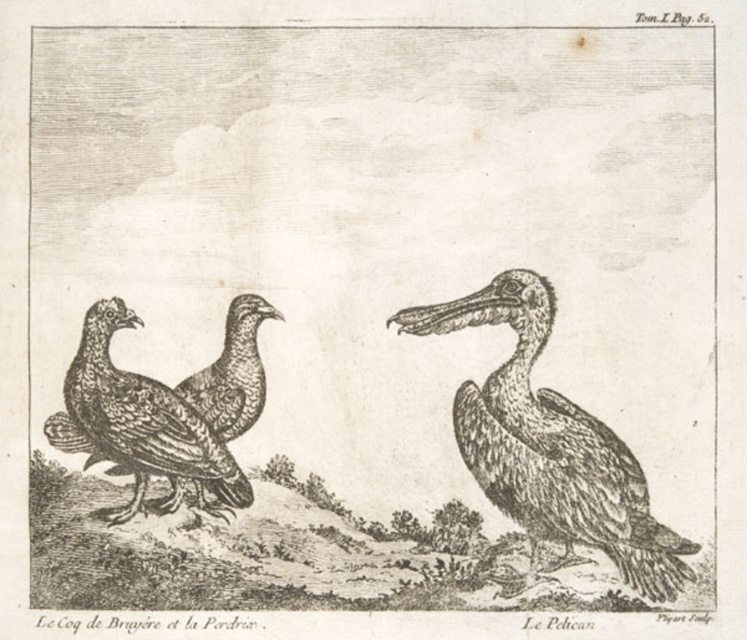
Can you confirm if gray textured pelican at center is bigger than smooth gray beak at center right?

Yes, gray textured pelican at center is bigger than smooth gray beak at center right.

Does gray textured pelican at center have a smaller size compared to smooth gray beak at center right?

No, gray textured pelican at center is not smaller than smooth gray beak at center right.

The height and width of the screenshot is (640, 747). Find the location of `gray textured pelican at center`. gray textured pelican at center is located at coordinates (551, 445).

Which is in front, point (149, 406) or point (396, 316)?

Point (149, 406) is in front.

This screenshot has height=640, width=747. Describe the element at coordinates (164, 412) in the screenshot. I see `brown textured birds at left` at that location.

Is point (49, 433) positioned before point (433, 316)?

Yes, it is in front of point (433, 316).

The width and height of the screenshot is (747, 640). Find the location of `brown textured birds at left`. brown textured birds at left is located at coordinates (164, 412).

Where is `gray textured pelican at center`? This screenshot has height=640, width=747. gray textured pelican at center is located at coordinates (551, 445).